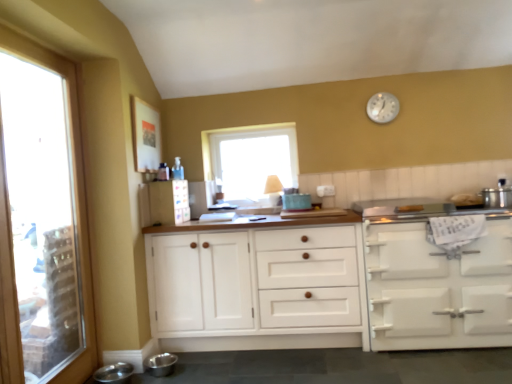
Question: Should I look upward or downward to see stainless steel bowls at lower left, the 1th appliance from the bottom?

Choices:
 (A) down
 (B) up

Answer: (A)

Question: Is silver metallic clock at upper center shorter than white wood cabinet at center, marked as the 2th cabinetry in a right-to-left arrangement?

Choices:
 (A) no
 (B) yes

Answer: (B)

Question: Does silver metallic clock at upper center have a larger size compared to white wood cabinet at center, the 1th cabinetry when ordered from left to right?

Choices:
 (A) no
 (B) yes

Answer: (A)

Question: From the image's perspective, is silver metallic clock at upper center below white wood cabinet at center, the 1th cabinetry when ordered from left to right?

Choices:
 (A) no
 (B) yes

Answer: (A)

Question: Can you confirm if silver metallic clock at upper center is wider than white wood cabinet at center, the 1th cabinetry when ordered from left to right?

Choices:
 (A) no
 (B) yes

Answer: (A)

Question: From the image's perspective, would you say silver metallic clock at upper center is positioned over white wood cabinet at center, marked as the 2th cabinetry in a right-to-left arrangement?

Choices:
 (A) no
 (B) yes

Answer: (B)

Question: Considering the relative sizes of silver metallic clock at upper center and white wood cabinet at center, the 1th cabinetry when ordered from left to right, in the image provided, is silver metallic clock at upper center taller than white wood cabinet at center, the 1th cabinetry when ordered from left to right,?

Choices:
 (A) no
 (B) yes

Answer: (A)

Question: Can you confirm if stainless steel bowls at lower left, which ranks as the third appliance in right-to-left order, is positioned to the right of transparent glass window at center, which is the second window in left-to-right order?

Choices:
 (A) no
 (B) yes

Answer: (A)

Question: Can you confirm if stainless steel bowls at lower left, the 1th appliance from the bottom, is bigger than transparent glass window at center, which is the second window in left-to-right order?

Choices:
 (A) yes
 (B) no

Answer: (B)

Question: Does stainless steel bowls at lower left, positioned as the first appliance in front-to-back order, lie behind transparent glass window at center, the first window positioned from the back?

Choices:
 (A) no
 (B) yes

Answer: (A)

Question: From a real-world perspective, is stainless steel bowls at lower left, which is the 3th appliance from back to front, positioned under transparent glass window at center, which is the second window in left-to-right order, based on gravity?

Choices:
 (A) yes
 (B) no

Answer: (A)

Question: Does stainless steel bowls at lower left, positioned as the first appliance in front-to-back order, have a lesser width compared to transparent glass window at center, the 2th window in the front-to-back sequence?

Choices:
 (A) no
 (B) yes

Answer: (A)

Question: Does stainless steel bowls at lower left, positioned as the first appliance in front-to-back order, have a lesser height compared to transparent glass window at center, the 2th window in the front-to-back sequence?

Choices:
 (A) yes
 (B) no

Answer: (A)

Question: Are stainless steel bowls at lower left, positioned as the first appliance in front-to-back order, and clear glass window at left, which ranks as the second window in back-to-front order, beside each other?

Choices:
 (A) yes
 (B) no

Answer: (B)